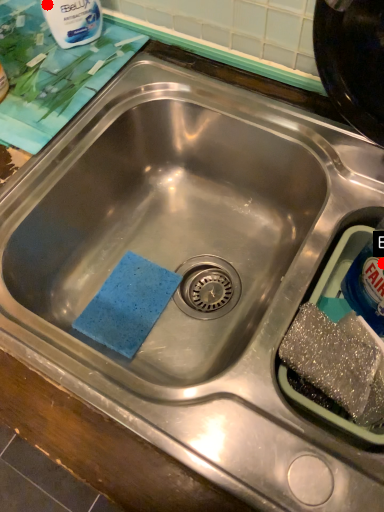
Question: Two points are circled on the image, labeled by A and B beside each circle. Which of the following is the farthest from the observer?

Choices:
 (A) A is further
 (B) B is further

Answer: (A)